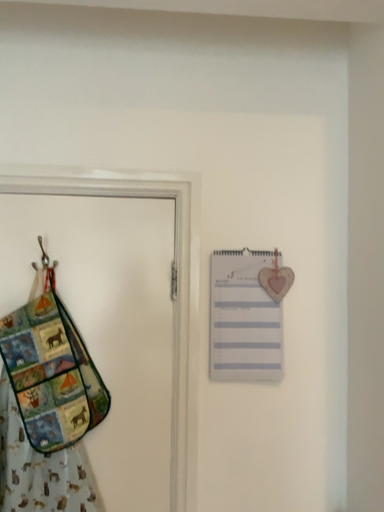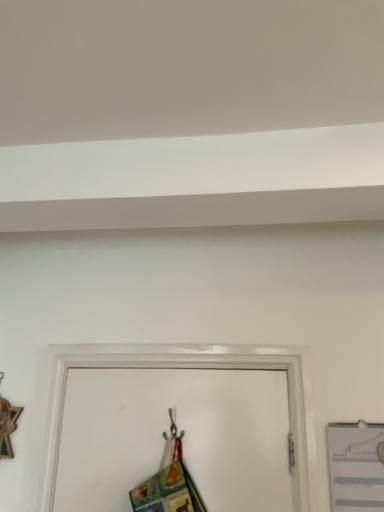
Question: Which way did the camera rotate in the video?

Choices:
 (A) rotated left
 (B) rotated right

Answer: (A)